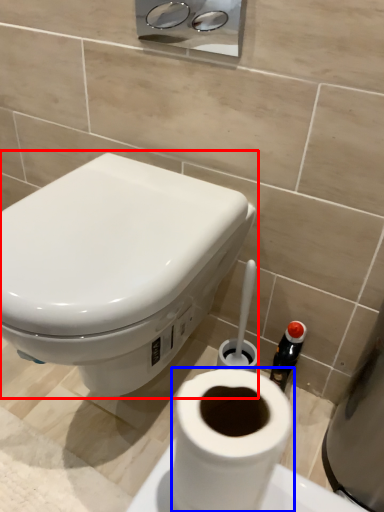
Question: Which point is closer to the camera, toilet (highlighted by a red box) or toilet paper (highlighted by a blue box)?

Choices:
 (A) toilet
 (B) toilet paper

Answer: (B)